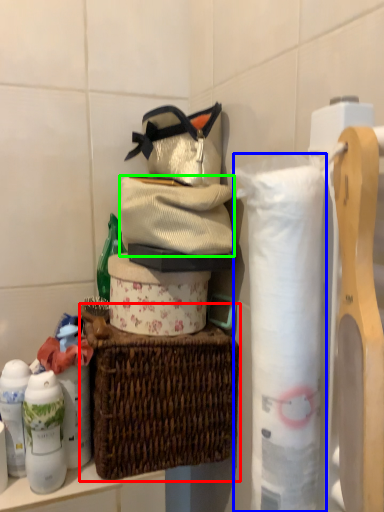
Question: Based on their relative distances, which object is nearer to picnic basket (highlighted by a red box)? Choose from toilet paper (highlighted by a blue box) and clothing (highlighted by a green box).

Choices:
 (A) toilet paper
 (B) clothing

Answer: (B)